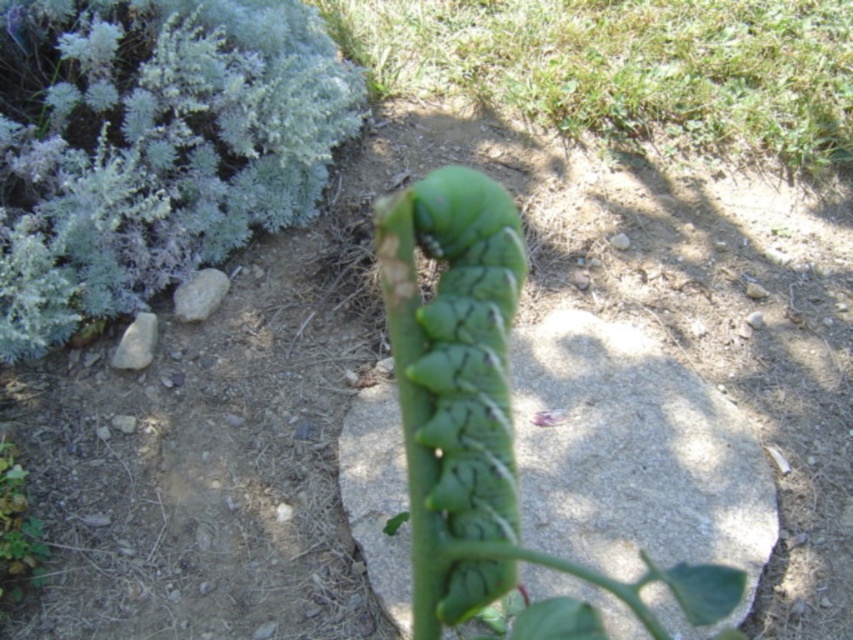
Question: Estimate the real-world distances between objects in this image. Which object is farther from the green matte plant at lower left?

Choices:
 (A) green matte caterpillar at center
 (B) green rough stone at center

Answer: (B)

Question: Can you confirm if silvery-green fuzzy bush at upper left is bigger than green matte caterpillar at center?

Choices:
 (A) yes
 (B) no

Answer: (A)

Question: Estimate the real-world distances between objects in this image. Which object is farther from the green textured caterpillar at center?

Choices:
 (A) green rough stone at center
 (B) silvery-green fuzzy bush at upper left

Answer: (A)

Question: Can you confirm if silvery-green fuzzy bush at upper left is positioned to the right of green matte plant at lower left?

Choices:
 (A) no
 (B) yes

Answer: (B)

Question: Which of these objects is positioned closest to the green matte plant at lower left?

Choices:
 (A) green rough stone at center
 (B) green textured caterpillar at center
 (C) silvery-green fuzzy bush at upper left

Answer: (C)

Question: Where is green textured caterpillar at center located in relation to green matte plant at lower left in the image?

Choices:
 (A) left
 (B) right

Answer: (B)